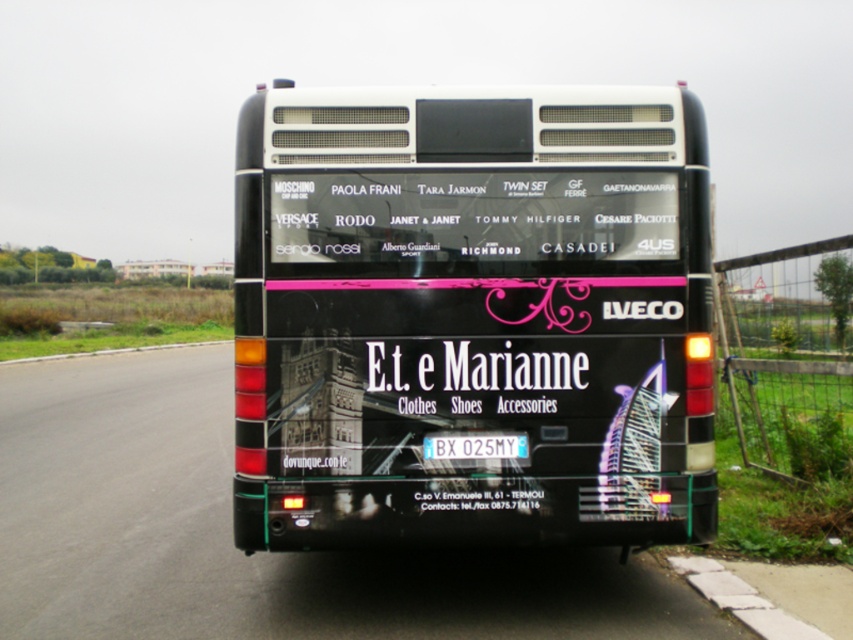
Consider the image. You are a delivery driver who needs to park your vehicle behind the black glossy bus at center so that your license plate is visible from the front. Can you park your vehicle in such a way that your license plate is not blocked by the blue metallic license plate at center?

The black glossy bus at center is positioned on the left side of the blue metallic license plate at center. Since the license plate is on the bus, parking behind it would place your vehicle behind both the bus and its license plate. To ensure your license plate remains visible, position your vehicle slightly to the right of the bus so that the blue metallic license plate at center does not obstruct your own plate.

In the scene shown: You are standing in front of the black Iveco bus and notice two points on its advertisement panel. The first point is at coordinates point (677, 234) and the second is at point (456, 458). Which point is closer to you?

Point (677, 234) is further to the viewer than point (456, 458), so the second point is closer to you.